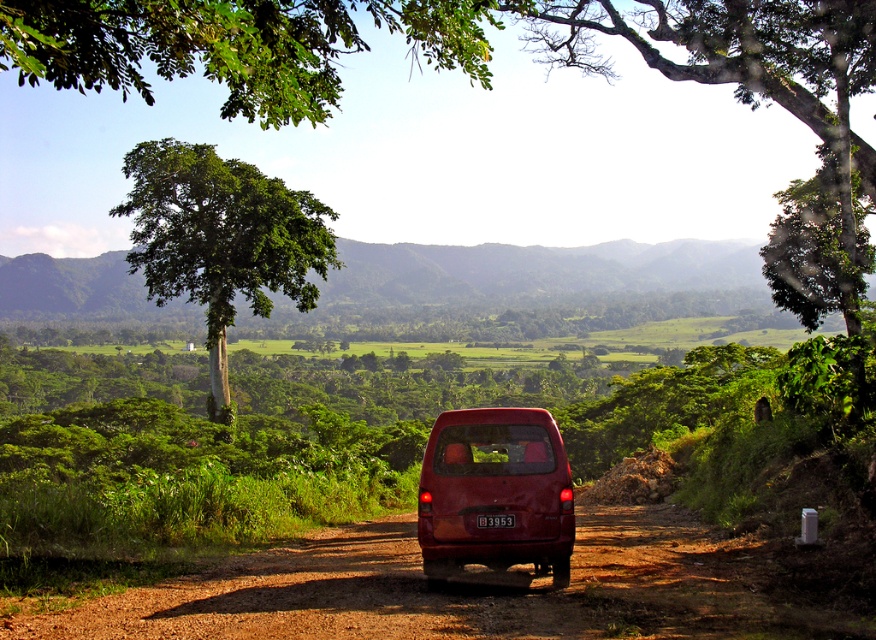
Question: Among these objects, which one is nearest to the camera?

Choices:
 (A) red plastic license plate at rear center
 (B) dusty brown dirt track at center
 (C) matte red van at center

Answer: (B)

Question: Among these points, which one is nearest to the camera?

Choices:
 (A) (467, 432)
 (B) (205, 588)

Answer: (A)

Question: Considering the relative positions of dusty brown dirt track at center and red plastic license plate at rear center in the image provided, where is dusty brown dirt track at center located with respect to red plastic license plate at rear center?

Choices:
 (A) above
 (B) below

Answer: (B)

Question: Which point is farther to the camera?

Choices:
 (A) green leafy tree at upper left
 (B) matte red van at center

Answer: (A)

Question: Can you confirm if dusty brown dirt track at center is positioned to the left of matte red van at center?

Choices:
 (A) yes
 (B) no

Answer: (A)

Question: Can you confirm if dusty brown dirt track at center is positioned to the left of red plastic license plate at rear center?

Choices:
 (A) no
 (B) yes

Answer: (B)